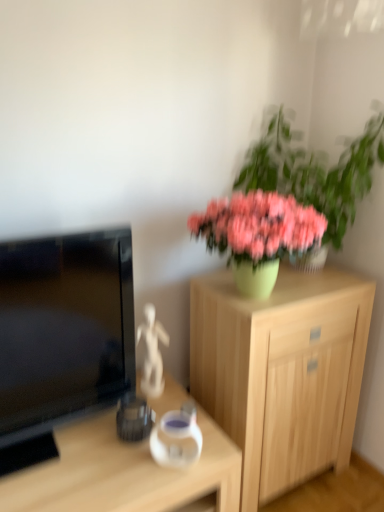
In order to face matte black television at left, should I rotate leftwards or rightwards?

A 15.629 degree turn to the left will do.

This screenshot has width=384, height=512. I want to click on transparent glass vase at center, so click(x=176, y=439).

The height and width of the screenshot is (512, 384). What do you see at coordinates (281, 372) in the screenshot? I see `light wood cabinet at center` at bounding box center [281, 372].

The image size is (384, 512). What are the coordinates of `green matte vase at upper right` in the screenshot? It's located at (288, 202).

Based on the photo, are matte wood desk at lower left and light wood cabinet at center located far from each other?

No, matte wood desk at lower left is in close proximity to light wood cabinet at center.

From the image's perspective, between matte wood desk at lower left and light wood cabinet at center, which one is located above?

light wood cabinet at center, from the image's perspective.

Which of these two, matte wood desk at lower left or light wood cabinet at center, is smaller?

With smaller size is matte wood desk at lower left.

Is matte wood desk at lower left not within light wood cabinet at center?

Yes, matte wood desk at lower left is not within light wood cabinet at center.

Between matte wood desk at lower left and matte black television at left, which one appears on the left side from the viewer's perspective?

matte black television at left.

Do you think matte wood desk at lower left is within matte black television at left, or outside of it?

matte wood desk at lower left is spatially situated outside matte black television at left.

Is matte wood desk at lower left not near matte black television at left?

No, there isn't a large distance between matte wood desk at lower left and matte black television at left.

How distant is matte wood desk at lower left from matte black television at left?

The distance of matte wood desk at lower left from matte black television at left is 10.72 inches.

Between matte black television at left and matte wood desk at lower left, which one has more height?

Standing taller between the two is matte black television at left.

Considering the sizes of matte black television at left and matte wood desk at lower left in the image, is matte black television at left wider or thinner than matte wood desk at lower left?

Considering their sizes, matte black television at left looks slimmer than matte wood desk at lower left.

Between matte black television at left and matte wood desk at lower left, which one appears on the right side from the viewer's perspective?

Positioned to the right is matte wood desk at lower left.

How different are the orientations of matte black television at left and matte wood desk at lower left in degrees?

matte black television at left and matte wood desk at lower left are facing 0.000345 degrees away from each other.

Consider the image. From the image's perspective, is green matte vase at upper right under matte black television at left?

No, from the image's perspective, green matte vase at upper right is not beneath matte black television at left.

In the scene shown: Between green matte vase at upper right and matte black television at left, which one appears on the left side from the viewer's perspective?

From the viewer's perspective, matte black television at left appears more on the left side.

Which of these two, green matte vase at upper right or matte black television at left, is wider?

green matte vase at upper right is wider.

Considering the positions of point (286, 147) and point (43, 406), is point (286, 147) closer or farther from the camera than point (43, 406)?

Point (286, 147).

Choose the correct answer: Is transparent glass vase at center inside matte black television at left or outside it?

The correct answer is: outside.

From the image's perspective, is transparent glass vase at center positioned above or below matte black television at left?

From the image's perspective, transparent glass vase at center appears below matte black television at left.

Does transparent glass vase at center have a smaller size compared to matte black television at left?

Yes, transparent glass vase at center is smaller than matte black television at left.

Between transparent glass vase at center and matte black television at left, which one appears on the left side from the viewer's perspective?

matte black television at left is more to the left.

Identify the location of cabinetry that appears below the green matte vase at upper right (from the image's perspective). (281, 372).

Who is bigger, green matte vase at upper right or light wood cabinet at center?

With larger size is light wood cabinet at center.

Considering the relative positions of green matte vase at upper right and light wood cabinet at center in the image provided, is green matte vase at upper right to the left of light wood cabinet at center from the viewer's perspective?

In fact, green matte vase at upper right is to the right of light wood cabinet at center.

Considering the positions of point (233, 207) and point (292, 331), is point (233, 207) closer or farther from the camera than point (292, 331)?

Clearly, point (233, 207) is closer to the camera than point (292, 331).

Which of these two, light wood cabinet at center or matte wood desk at lower left, is bigger?

light wood cabinet at center.

Relative to matte wood desk at lower left, is light wood cabinet at center in front or behind?

Clearly, light wood cabinet at center is behind matte wood desk at lower left.

From the image's perspective, is light wood cabinet at center above matte wood desk at lower left?

Yes, from the image's perspective, light wood cabinet at center is on top of matte wood desk at lower left.

Find the location of `cabinetry located behind the matte wood desk at lower left`. cabinetry located behind the matte wood desk at lower left is located at coordinates (281, 372).

Identify the location of desk on the right of the matte black television at left. (122, 473).

From the picture: When comparing their distances from transparent glass vase at center, does light wood cabinet at center or green matte vase at upper right seem further?

green matte vase at upper right lies further to transparent glass vase at center than the other object.

Looking at the image, which one is located closer to transparent glass vase at center, matte wood desk at lower left or light wood cabinet at center?

Among the two, matte wood desk at lower left is located nearer to transparent glass vase at center.

Considering their positions, is green matte vase at upper right positioned further to light wood cabinet at center than transparent glass vase at center?

The object further to light wood cabinet at center is transparent glass vase at center.

Looking at the image, which one is located further to matte wood desk at lower left, transparent glass vase at center or light wood cabinet at center?

The object further to matte wood desk at lower left is light wood cabinet at center.

Looking at the image, which one is located closer to matte wood desk at lower left, green matte vase at upper right or matte black television at left?

Among the two, matte black television at left is located nearer to matte wood desk at lower left.

Considering their positions, is matte wood desk at lower left positioned closer to light wood cabinet at center than green matte vase at upper right?

Based on the image, green matte vase at upper right appears to be nearer to light wood cabinet at center.

Based on their spatial positions, is green matte vase at upper right or light wood cabinet at center closer to matte wood desk at lower left?

Among the two, light wood cabinet at center is located nearer to matte wood desk at lower left.

Estimate the real-world distances between objects in this image. Which object is further from light wood cabinet at center, matte wood desk at lower left or transparent glass vase at center?

transparent glass vase at center is positioned further to the anchor light wood cabinet at center.

Identify the location of cabinetry situated between matte black television at left and green matte vase at upper right from left to right. Image resolution: width=384 pixels, height=512 pixels. (281, 372).

Locate an element on the screen. vase located between matte black television at left and light wood cabinet at center in the left-right direction is located at coordinates (176, 439).

Locate an element on the screen. The image size is (384, 512). cabinetry between green matte vase at upper right and transparent glass vase at center from top to bottom is located at coordinates (281, 372).

What are the coordinates of `cabinetry between green matte vase at upper right and matte wood desk at lower left in the vertical direction` in the screenshot? It's located at (281, 372).